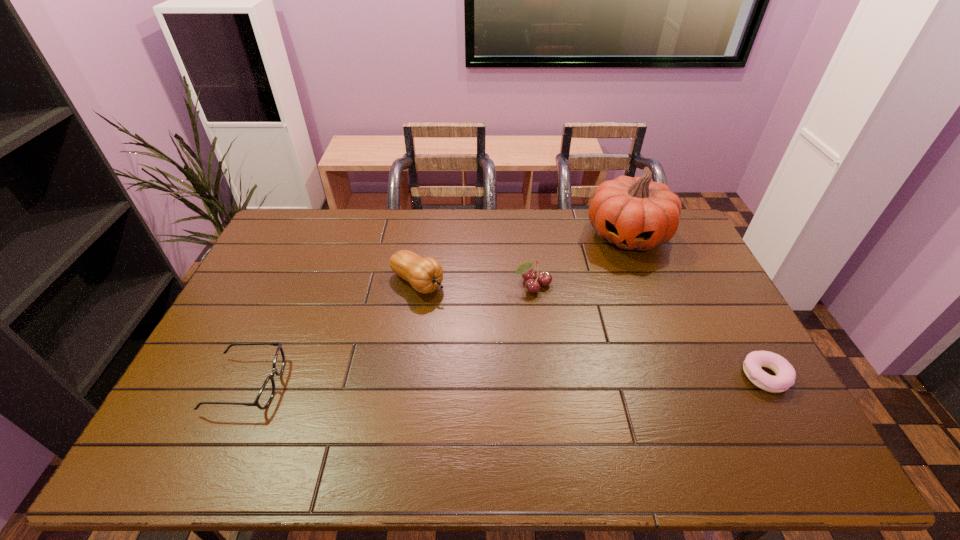
The height and width of the screenshot is (540, 960). In the image, there is a desktop. What are the coordinates of `free region at the near right corner` in the screenshot? It's located at (725, 403).

The image size is (960, 540). What are the coordinates of `free spot between the pumpkin and the fourth tallest object` in the screenshot? It's located at pyautogui.click(x=437, y=310).

You are a GUI agent. You are given a task and a screenshot of the screen. Output one action in this format:
    pyautogui.click(x=<x>, y=<y>)
    Task: Click on the empty space that is in between the tallest object and the leftmost object
    
    Given the screenshot: What is the action you would take?
    pyautogui.click(x=437, y=310)

At what (x,y) coordinates should I click in order to perform the action: click on vacant area that lies between the fourth tallest object and the shortest object. Please return your answer as a coordinate pair (x, y). The width and height of the screenshot is (960, 540). Looking at the image, I should click on (506, 380).

Image resolution: width=960 pixels, height=540 pixels. In order to click on vacant space that's between the cherry and the spectacles in this screenshot , I will do pyautogui.click(x=390, y=335).

Where is `free space that is in between the leftmost object and the third object from left to right`? The image size is (960, 540). free space that is in between the leftmost object and the third object from left to right is located at coordinates (390, 335).

Locate an element on the screen. The height and width of the screenshot is (540, 960). free space between the tallest object and the spectacles is located at coordinates (437, 310).

Locate an element on the screen. The width and height of the screenshot is (960, 540). vacant point located between the leftmost object and the shortest object is located at coordinates (506, 380).

Image resolution: width=960 pixels, height=540 pixels. I want to click on free space between the leftmost object and the tallest object, so click(x=437, y=310).

Image resolution: width=960 pixels, height=540 pixels. I want to click on vacant space that is in between the second shortest object and the shortest object, so click(x=506, y=380).